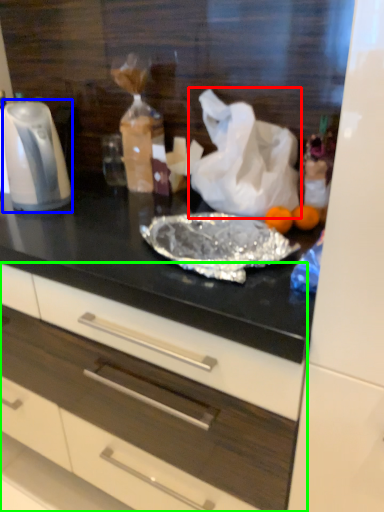
Question: Which object is positioned farthest from plastic bag (highlighted by a red box)? Select from kitchen appliance (highlighted by a blue box) and drawer (highlighted by a green box).

Choices:
 (A) kitchen appliance
 (B) drawer

Answer: (B)